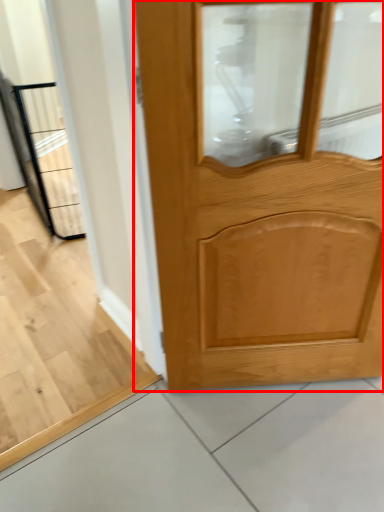
Question: From the image, what is the correct spatial relationship of door (annotated by the red box) in relation to elevator?

Choices:
 (A) right
 (B) left

Answer: (A)